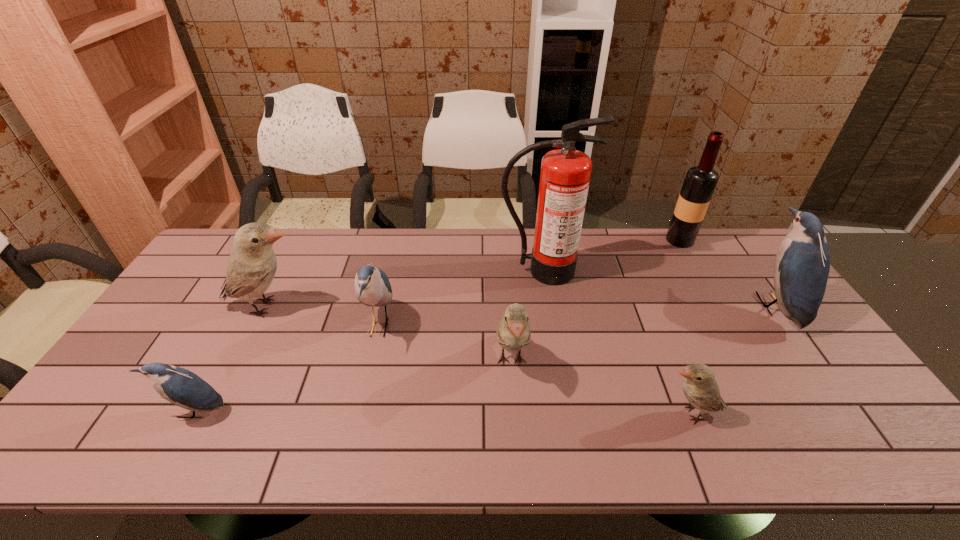
The image size is (960, 540). I want to click on blue bird identified as the third closest to the tallest object, so click(x=185, y=389).

Where is `white bird that is the closest one to the leftmost blue bird`? This screenshot has width=960, height=540. white bird that is the closest one to the leftmost blue bird is located at coordinates (252, 264).

Identify which white bird is the third nearest to the biggest blue bird. Please provide its 2D coordinates. Your answer should be formatted as a tuple, i.e. [(x, y)], where the tuple contains the x and y coordinates of a point satisfying the conditions above.

[(252, 264)]

You are a GUI agent. You are given a task and a screenshot of the screen. Output one action in this format:
    pyautogui.click(x=<x>, y=<y>)
    Task: Click on the vacant space that satisfies the following two spatial constraints: 1. on the front-facing side of the tallest object; 2. at the tip of the sixth object from right to left's beak
    This screenshot has height=540, width=960.
    Given the screenshot: What is the action you would take?
    pyautogui.click(x=550, y=326)

Where is `vacant space that satisfies the following two spatial constraints: 1. on the front-facing side of the red fire extinguisher; 2. at the face of the leftmost white bird`? The width and height of the screenshot is (960, 540). vacant space that satisfies the following two spatial constraints: 1. on the front-facing side of the red fire extinguisher; 2. at the face of the leftmost white bird is located at coordinates (547, 307).